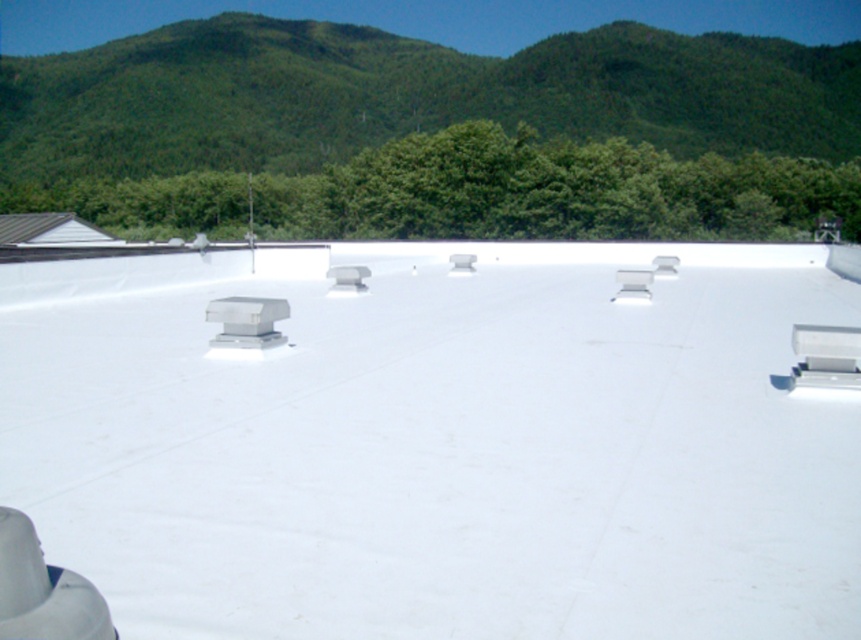
You are standing on the flat rooftop and want to take a photo of the green forested hill at upper center. Which direction should you face to capture it in your viewfinder?

The green forested hill at upper center is located at point coordinates, so you should face the upper center direction to capture it in your viewfinder.

You are a drone operator planning to fly a drone from the metallic gray roof at left to the green forested hill at upper center. Based on the scene, which object is wider, requiring more horizontal space for navigation?

The green forested hill at upper center might be wider than metallic gray roof at left, so it requires more horizontal space for navigation.